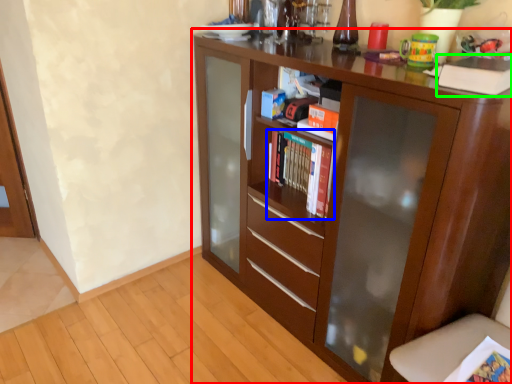
Question: Considering the real-world distances, which object is farthest from cupboard (highlighted by a red box)? book (highlighted by a blue box) or paperback book (highlighted by a green box)?

Choices:
 (A) book
 (B) paperback book

Answer: (B)